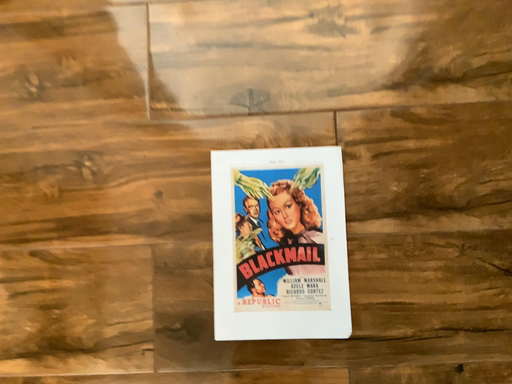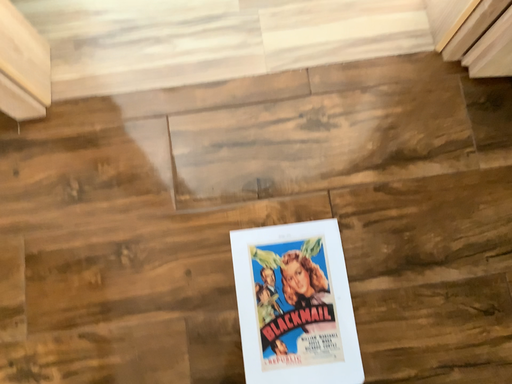
Question: How did the camera likely rotate when shooting the video?

Choices:
 (A) rotated upward
 (B) rotated downward

Answer: (A)